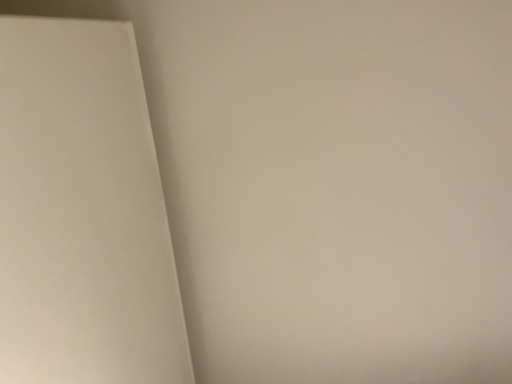
The height and width of the screenshot is (384, 512). What do you see at coordinates (83, 213) in the screenshot?
I see `white matte door at upper left` at bounding box center [83, 213].

The image size is (512, 384). I want to click on white matte door at upper left, so click(83, 213).

The height and width of the screenshot is (384, 512). I want to click on white matte door at upper left, so click(83, 213).